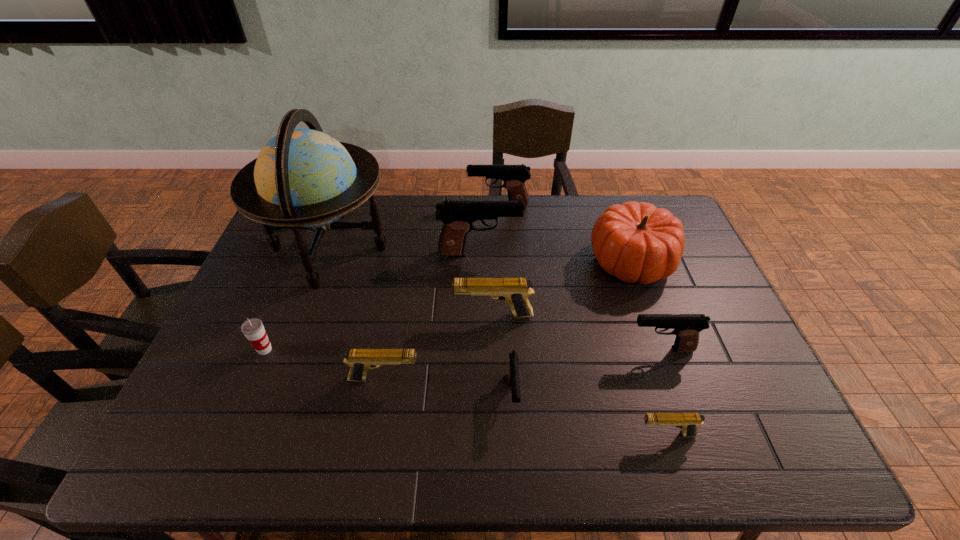
Find the location of a particular element. The height and width of the screenshot is (540, 960). cup is located at coordinates (253, 329).

Find the location of a particular element. This screenshot has width=960, height=540. the leftmost pistol is located at coordinates (360, 361).

You are a GUI agent. You are given a task and a screenshot of the screen. Output one action in this format:
    pyautogui.click(x=<x>, y=<y>)
    Task: Click on the second biggest tan pistol
    
    Given the screenshot: What is the action you would take?
    pyautogui.click(x=360, y=361)

Where is `the smallest black pistol`? The width and height of the screenshot is (960, 540). the smallest black pistol is located at coordinates pos(513,371).

Identify the location of the shortest pistol. This screenshot has height=540, width=960. (688, 422).

This screenshot has width=960, height=540. What are the coordinates of `the shortest object` in the screenshot? It's located at (688, 422).

Where is `free space located 0.390m on the surface of the globe`? The image size is (960, 540). free space located 0.390m on the surface of the globe is located at coordinates (509, 248).

Locate an element on the screen. Image resolution: width=960 pixels, height=540 pixels. free space located 0.280m at the barrel of the tallest pistol is located at coordinates (606, 253).

Where is `vacant space located 0.330m on the left of the pumpkin`? The image size is (960, 540). vacant space located 0.330m on the left of the pumpkin is located at coordinates (487, 261).

This screenshot has height=540, width=960. I want to click on vacant space situated at the barrel of the second biggest black pistol, so click(408, 206).